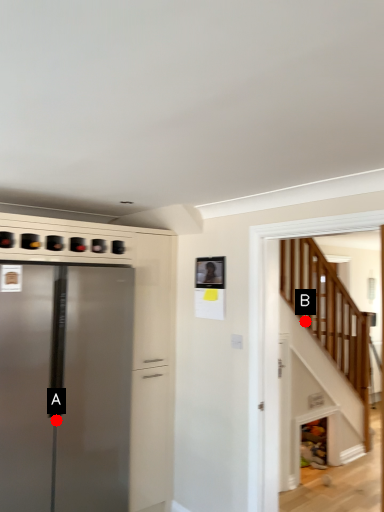
Question: Two points are circled on the image, labeled by A and B beside each circle. Which point is closer to the camera?

Choices:
 (A) A is closer
 (B) B is closer

Answer: (A)